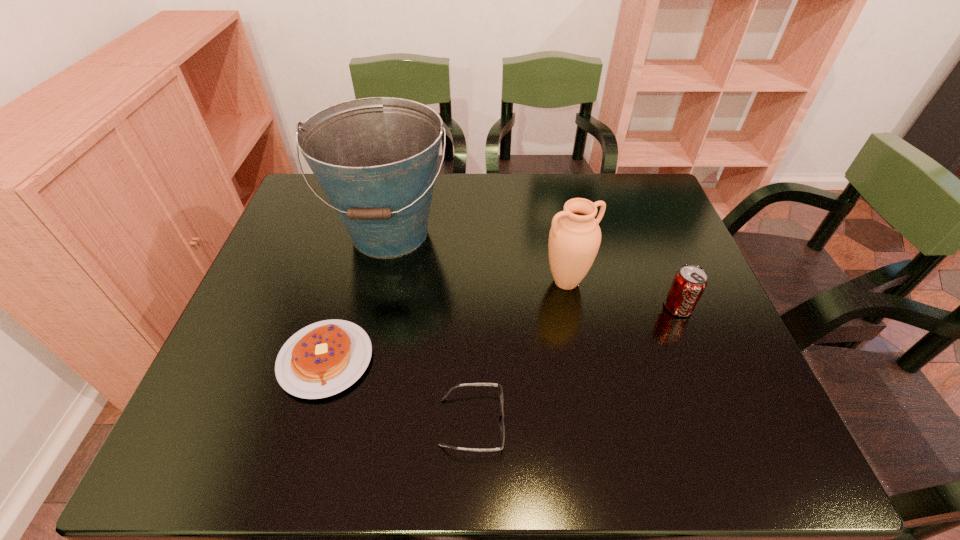
I want to click on blank space at the near edge, so click(x=426, y=441).

At what (x,y) coordinates should I click in order to perform the action: click on free space at the left edge of the desktop. Please return your answer as a coordinate pair (x, y). Looking at the image, I should click on (258, 314).

Locate an element on the screen. free space at the right edge of the desktop is located at coordinates (621, 228).

Find the location of a particular element. The image size is (960, 540). vacant area at the far left corner of the desktop is located at coordinates (302, 194).

This screenshot has height=540, width=960. Identify the location of free space at the far right corner of the desktop. (621, 187).

Identify the location of unoccupied position between the fourth object from left to right and the third object from left to right. (519, 352).

Find the location of `vacant region between the shortest object and the bucket`. vacant region between the shortest object and the bucket is located at coordinates (431, 327).

In order to click on free spot between the rightmost object and the urn in this screenshot , I will do `click(622, 294)`.

Image resolution: width=960 pixels, height=540 pixels. Identify the location of vacant point located between the pop soda and the pancake. pos(502,333).

The image size is (960, 540). I want to click on vacant space that is in between the shortest object and the third shortest object, so click(575, 364).